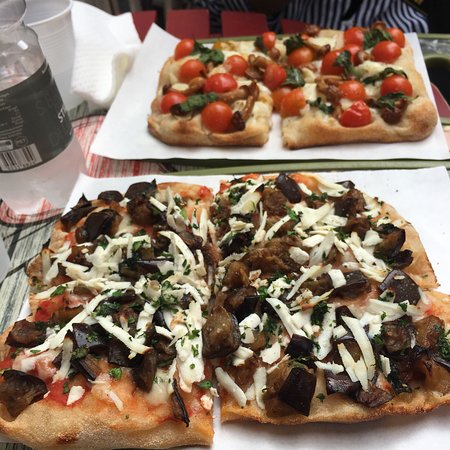
The width and height of the screenshot is (450, 450). Identify the location of plate. (335, 165), (229, 38).